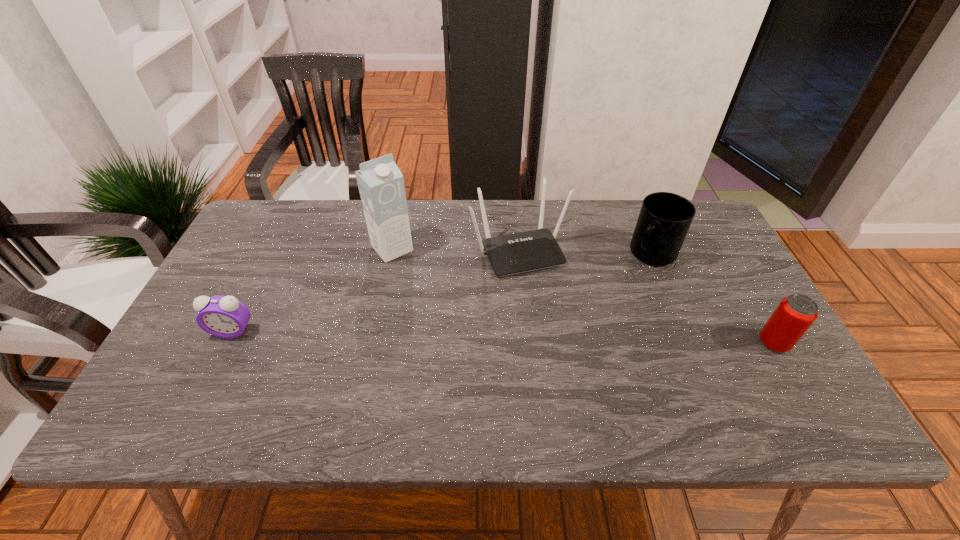
I want to click on object that stands as the third closest to the second object from left to right, so click(664, 220).

Where is `object that is the fourth closest one to the shortest object`? The width and height of the screenshot is (960, 540). object that is the fourth closest one to the shortest object is located at coordinates (794, 315).

Where is `vacant space that satisfies the following two spatial constraints: 1. on the front side of the fourth object from right to left; 2. on the left side of the third object from left to right`? The image size is (960, 540). vacant space that satisfies the following two spatial constraints: 1. on the front side of the fourth object from right to left; 2. on the left side of the third object from left to right is located at coordinates (392, 250).

What are the coordinates of `free space that satisfies the following two spatial constraints: 1. on the front side of the router; 2. on the right side of the rightmost object` in the screenshot? It's located at (527, 343).